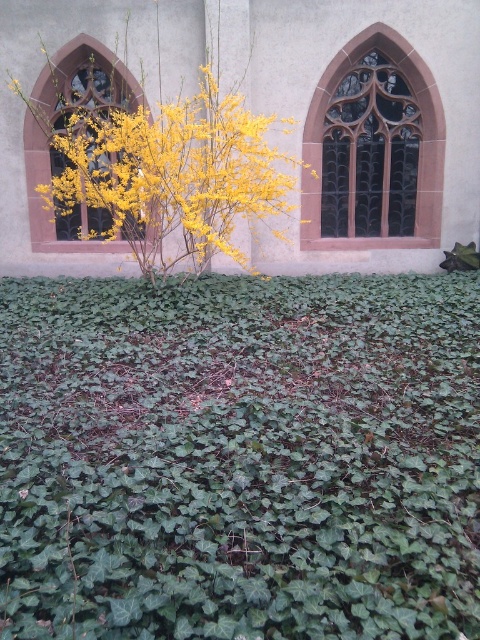
You are standing in front of the building with two arched windows. You need to locate the matte glass window at center and the dark glass window at upper center. Which window is positioned to the left of the other?

The matte glass window at center is to the left of the dark glass window at upper center.

You are an artist planning to paint this scene. You want to ensure the yellow matte flower at center and the dark glass window at upper center are proportionally accurate. Which object should you paint wider to maintain the correct scale?

The yellow matte flower at center should be painted wider than the dark glass window at upper center because its width is larger according to the description.

You are an artist sketching the scene and want to ensure proper proportions. Given that the yellow matte flower at center and the matte glass window at center are both central elements, which one should you draw first to maintain scale accuracy?

The yellow matte flower at center is larger than the matte glass window at center, so you should draw the yellow matte flower at center first to establish the scale before adding the smaller matte glass window at center.